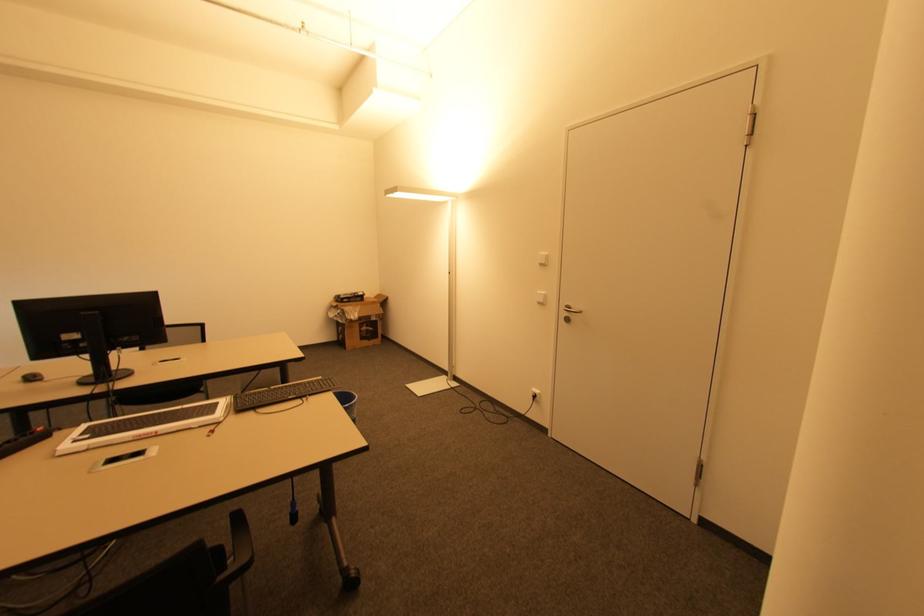
Locate an element on the screen. The width and height of the screenshot is (924, 616). silver door handle is located at coordinates (569, 312).